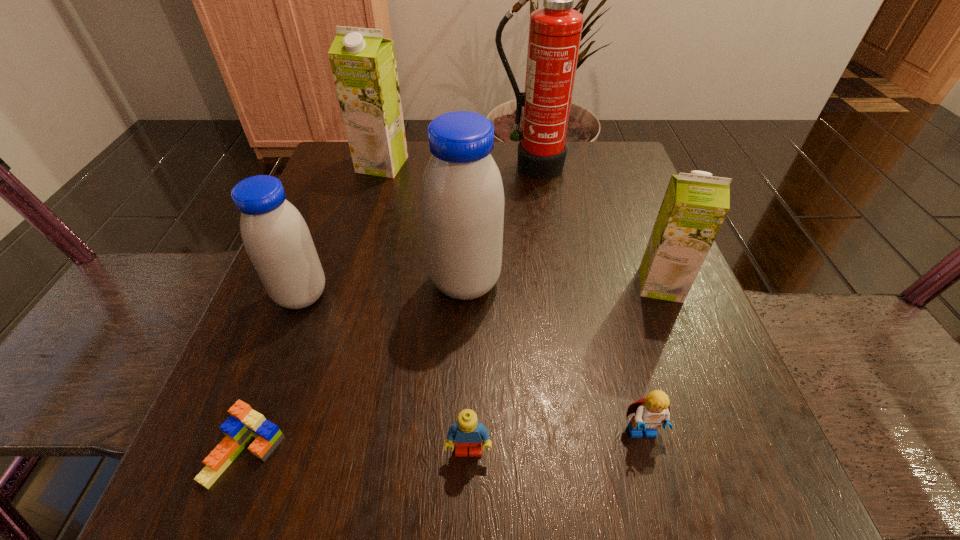
Identify the location of fire extinguisher located in the far edge section of the desktop. The image size is (960, 540). (555, 30).

This screenshot has height=540, width=960. What are the coordinates of `soya milk at the far edge` in the screenshot? It's located at (363, 63).

Where is `Lego present at the left edge`? This screenshot has width=960, height=540. Lego present at the left edge is located at coordinates (244, 424).

Find the location of a particular element. Image resolution: width=960 pixels, height=540 pixels. fire extinguisher that is at the right edge is located at coordinates (555, 30).

The width and height of the screenshot is (960, 540). Find the location of `soya milk at the right edge`. soya milk at the right edge is located at coordinates (695, 205).

The width and height of the screenshot is (960, 540). What are the coordinates of `Lego that is at the right edge` in the screenshot? It's located at (651, 412).

Identify the location of object situated at the far left corner. The image size is (960, 540). (363, 63).

Identify the location of object positioned at the near left corner. The height and width of the screenshot is (540, 960). coord(244,424).

This screenshot has width=960, height=540. Find the location of `object at the far right corner`. object at the far right corner is located at coordinates (555, 30).

You are a GUI agent. You are given a task and a screenshot of the screen. Output one action in this format:
    pyautogui.click(x=<x>, y=<y>)
    Task: Click on the object that is at the near right corner
    This screenshot has width=960, height=540.
    Given the screenshot: What is the action you would take?
    pyautogui.click(x=651, y=412)